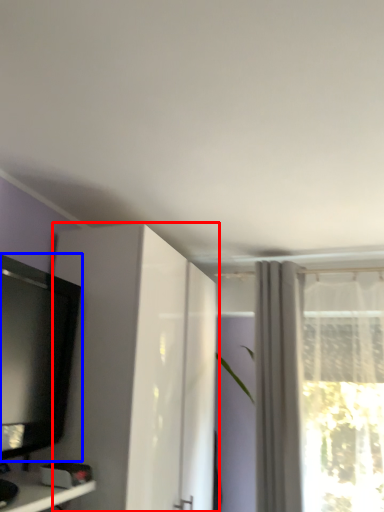
Question: Among these objects, which one is nearest to the camera, cabinetry (highlighted by a red box) or television (highlighted by a blue box)?

Choices:
 (A) cabinetry
 (B) television

Answer: (B)